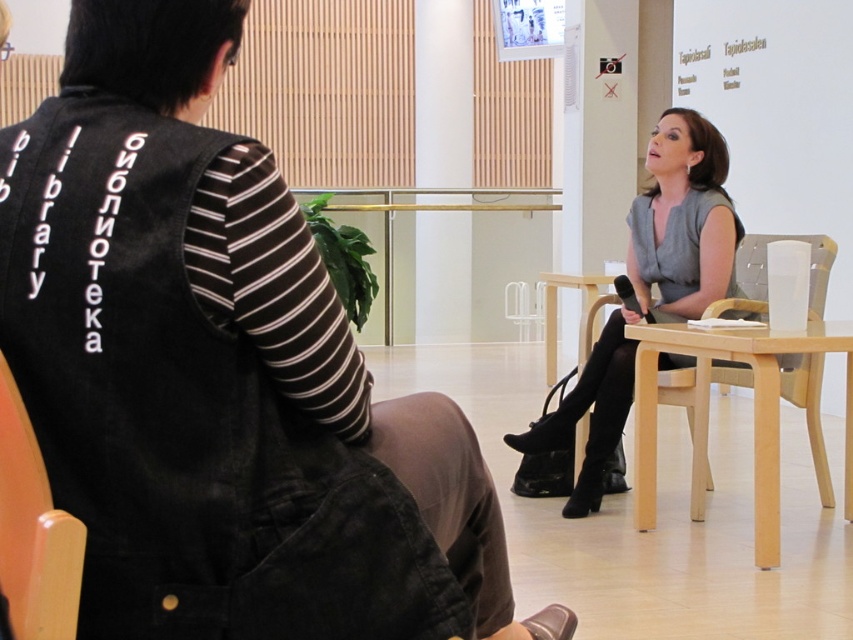
You are sitting in the wooden chair at lower left and want to move to the light wood armchair at right. Which direction should you move to reach it?

The wooden chair at lower left is above the light wood armchair at right, so you should move downward to reach it.